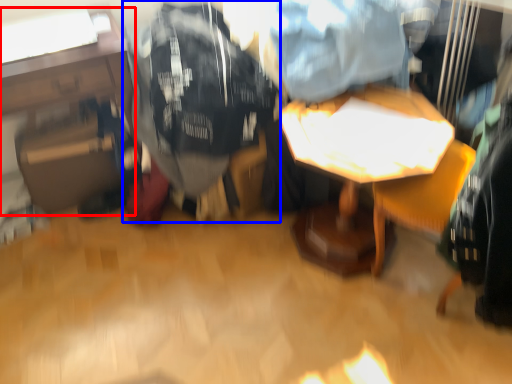
Question: Which object is further to the camera taking this photo, table (highlighted by a red box) or clothing (highlighted by a blue box)?

Choices:
 (A) table
 (B) clothing

Answer: (A)